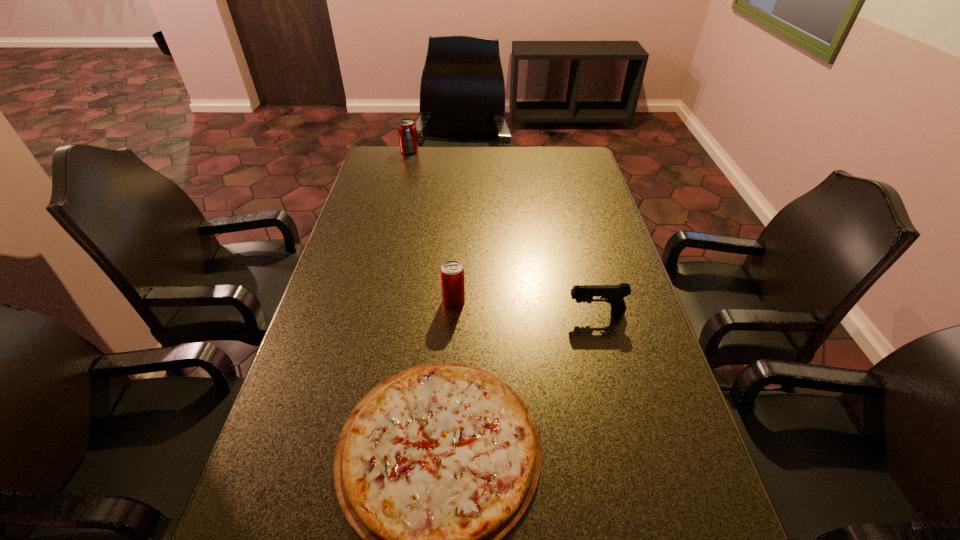
This screenshot has height=540, width=960. What are the coordinates of `vacant area that lies between the pop soda and the pistol` in the screenshot? It's located at (503, 232).

Locate an element on the screen. The height and width of the screenshot is (540, 960). unoccupied position between the pistol and the second farthest object is located at coordinates (525, 307).

The image size is (960, 540). What are the coordinates of `unoccupied area between the third nearest object and the pop soda` in the screenshot? It's located at (432, 226).

Image resolution: width=960 pixels, height=540 pixels. What are the coordinates of `object that stands as the second closest to the rightmost object` in the screenshot? It's located at (452, 276).

Point out which object is positioned as the third nearest to the nearest object. Please provide its 2D coordinates. Your answer should be formatted as a tuple, i.e. [(x, y)], where the tuple contains the x and y coordinates of a point satisfying the conditions above.

[(407, 131)]